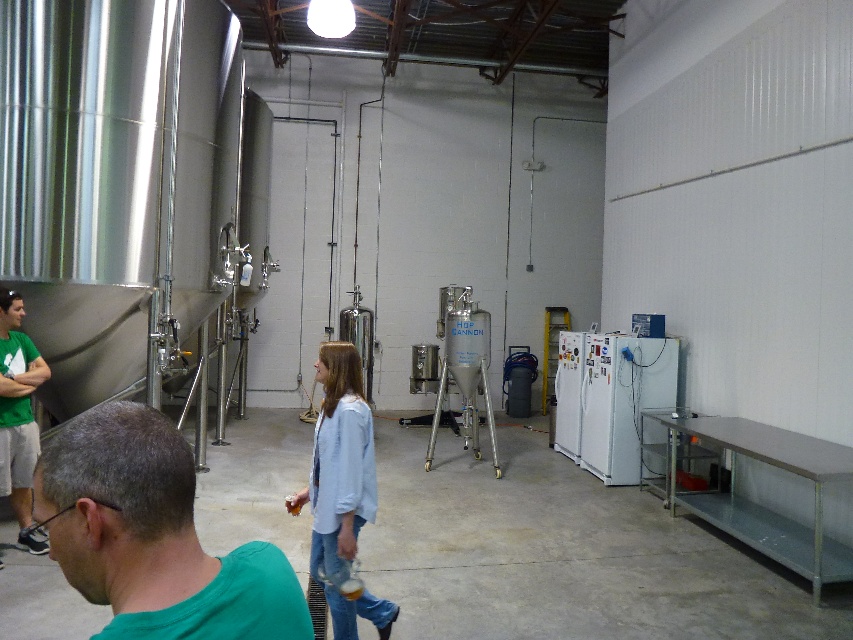
Does green matte shirt at lower left have a greater height compared to light blue denim jacket at center?

No, green matte shirt at lower left is not taller than light blue denim jacket at center.

Is green matte shirt at lower left wider than light blue denim jacket at center?

In fact, green matte shirt at lower left might be narrower than light blue denim jacket at center.

Image resolution: width=853 pixels, height=640 pixels. Find the location of `green matte shirt at lower left`. green matte shirt at lower left is located at coordinates (154, 536).

Measure the distance between point [149,417] and camera.

Point [149,417] is 3.50 feet from camera.

Consider the image. Is green matte shirt at lower left shorter than white matte refrigerator at right?

Indeed, green matte shirt at lower left has a lesser height compared to white matte refrigerator at right.

Who is more forward, (158,572) or (605,474)?

Point (158,572) is in front.

Where is `green matte shirt at lower left`? The height and width of the screenshot is (640, 853). green matte shirt at lower left is located at coordinates (154, 536).

Which is more to the right, green matte shirt at lower left or green t-shirt at left?

green matte shirt at lower left is more to the right.

Is green matte shirt at lower left taller than green t-shirt at left?

Incorrect, green matte shirt at lower left's height is not larger of green t-shirt at left's.

The image size is (853, 640). Describe the element at coordinates (154, 536) in the screenshot. I see `green matte shirt at lower left` at that location.

Image resolution: width=853 pixels, height=640 pixels. Find the location of `green matte shirt at lower left`. green matte shirt at lower left is located at coordinates (154, 536).